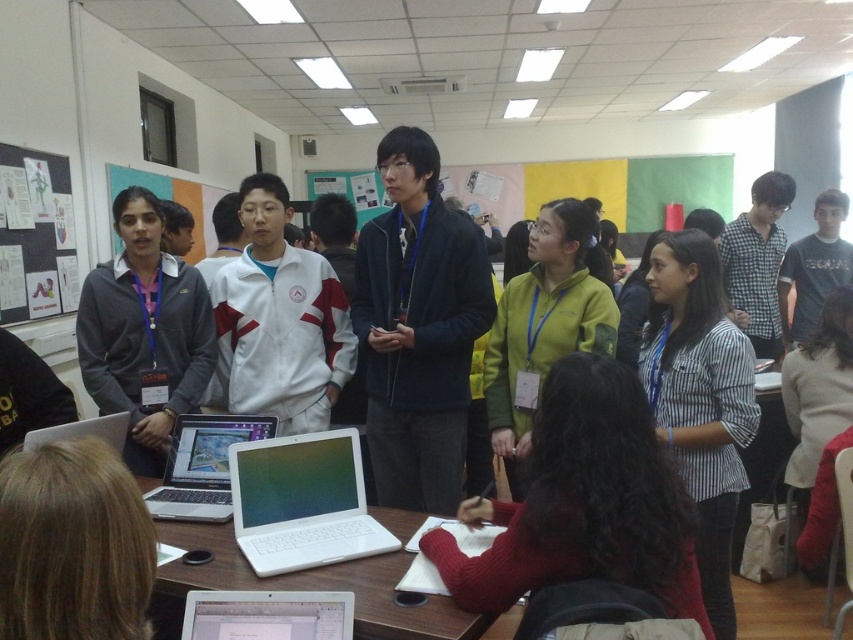
Does point (508, 298) lie behind point (120, 435)?

Yes.

Who is lower down, green fleece jacket at center or white glossy laptop at lower left?

Positioned lower is white glossy laptop at lower left.

The height and width of the screenshot is (640, 853). I want to click on green fleece jacket at center, so click(x=543, y=324).

Locate an element on the screen. The height and width of the screenshot is (640, 853). green fleece jacket at center is located at coordinates (543, 324).

Who is more distant from viewer, (285, 540) or (195, 596)?

The point (285, 540) is more distant.

Image resolution: width=853 pixels, height=640 pixels. Identify the location of white glossy laptop at center. (302, 502).

Who is more distant from viewer, (x=250, y=531) or (x=250, y=602)?

Positioned behind is point (x=250, y=531).

The height and width of the screenshot is (640, 853). I want to click on white glossy laptop at center, so click(x=302, y=502).

Can you confirm if striped cotton shirt at center is bigger than silver metallic laptop at center?

Yes, striped cotton shirt at center is bigger than silver metallic laptop at center.

In the scene shown: Can you confirm if striped cotton shirt at center is positioned to the left of silver metallic laptop at center?

No, striped cotton shirt at center is not to the left of silver metallic laptop at center.

Is point (653, 380) more distant than point (219, 445)?

Yes, it is.

I want to click on striped cotton shirt at center, so click(700, 400).